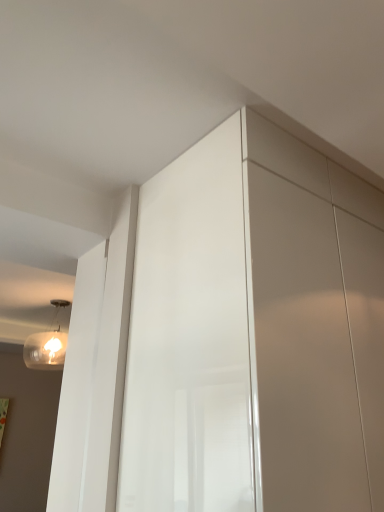
Question: Looking at the image, does translucent glass light fixture at upper left seem bigger or smaller compared to glossy white dresser at center?

Choices:
 (A) small
 (B) big

Answer: (A)

Question: Considering their positions, is translucent glass light fixture at upper left located in front of or behind glossy white dresser at center?

Choices:
 (A) front
 (B) behind

Answer: (B)

Question: Do you think translucent glass light fixture at upper left is within glossy white dresser at center, or outside of it?

Choices:
 (A) outside
 (B) inside

Answer: (A)

Question: Would you say glossy white dresser at center is to the left or to the right of translucent glass light fixture at upper left in the picture?

Choices:
 (A) left
 (B) right

Answer: (B)

Question: From a real-world perspective, relative to translucent glass light fixture at upper left, is glossy white dresser at center vertically above or below?

Choices:
 (A) above
 (B) below

Answer: (B)

Question: Is glossy white dresser at center bigger or smaller than translucent glass light fixture at upper left?

Choices:
 (A) small
 (B) big

Answer: (B)

Question: From the image's perspective, relative to translucent glass light fixture at upper left, is glossy white dresser at center above or below?

Choices:
 (A) above
 (B) below

Answer: (A)